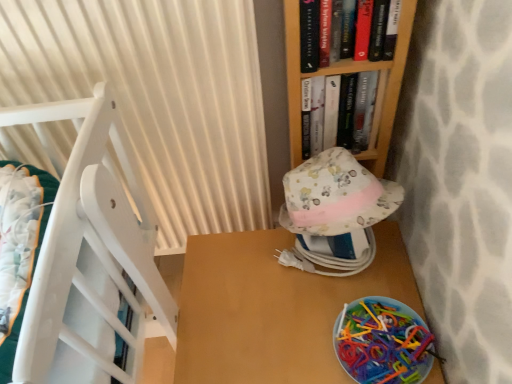
Find the location of `wooden table at lower right`. wooden table at lower right is located at coordinates (273, 308).

Where is `white pleated curtain at left`? The height and width of the screenshot is (384, 512). white pleated curtain at left is located at coordinates [x=158, y=97].

The height and width of the screenshot is (384, 512). Describe the element at coordinates (158, 97) in the screenshot. I see `white pleated curtain at left` at that location.

Describe the element at coordinates (335, 195) in the screenshot. This screenshot has width=512, height=384. I see `floral fabric hat at center` at that location.

What is the approximate width of hardcover book at upper center, the 2th book positioned from the back?

hardcover book at upper center, the 2th book positioned from the back, is 7.91 centimeters wide.

The height and width of the screenshot is (384, 512). Find the location of `translucent plastic toys at lower right`. translucent plastic toys at lower right is located at coordinates (383, 342).

The height and width of the screenshot is (384, 512). In order to click on hardcover book at upper center, arranged as the 1th book when viewed from the back in this screenshot , I will do `click(352, 108)`.

Where is `wooden table at lower right`? wooden table at lower right is located at coordinates (273, 308).

Is hardcover book at upper center, which ranks as the 1th book in front-to-back order, turned away from translucent plastic toys at lower right?

No, hardcover book at upper center, which ranks as the 1th book in front-to-back order, is not facing away from translucent plastic toys at lower right.

Does hardcover book at upper center, the 2th book positioned from the back, have a smaller size compared to translucent plastic toys at lower right?

No, hardcover book at upper center, the 2th book positioned from the back, is not smaller than translucent plastic toys at lower right.

Between hardcover book at upper center, which ranks as the 1th book in front-to-back order, and translucent plastic toys at lower right, which one appears on the right side from the viewer's perspective?

translucent plastic toys at lower right is more to the right.

Is hardcover book at upper center, which ranks as the 1th book in front-to-back order, beside translucent plastic toys at lower right?

They are not placed beside each other.

Relative to white pleated curtain at left, is translucent plastic toys at lower right in front or behind?

Clearly, translucent plastic toys at lower right is behind white pleated curtain at left.

From a real-world perspective, is translucent plastic toys at lower right physically located above or below white pleated curtain at left?

translucent plastic toys at lower right is below white pleated curtain at left.

Are translucent plastic toys at lower right and white pleated curtain at left beside each other?

translucent plastic toys at lower right and white pleated curtain at left are clearly separated.

Does point (407, 376) appear closer or farther from the camera than point (254, 87)?

Point (407, 376) is positioned closer to the camera compared to point (254, 87).

Does point (365, 124) appear closer or farther from the camera than point (302, 335)?

Point (365, 124) is positioned farther from the camera compared to point (302, 335).

Based on the photo, considering the relative positions of hardcover book at upper center, arranged as the 1th book when viewed from the back, and wooden table at lower right in the image provided, is hardcover book at upper center, arranged as the 1th book when viewed from the back, to the left of wooden table at lower right from the viewer's perspective?

No.

From a real-world perspective, does hardcover book at upper center, arranged as the 1th book when viewed from the back, sit lower than wooden table at lower right?

No, from a real-world perspective, hardcover book at upper center, arranged as the 1th book when viewed from the back, is not beneath wooden table at lower right.

Is hardcover book at upper center, arranged as the 1th book when viewed from the back, located outside white pleated curtain at left?

Yes, hardcover book at upper center, arranged as the 1th book when viewed from the back, is located beyond the bounds of white pleated curtain at left.

From a real-world perspective, between hardcover book at upper center, which is the second book from front to back, and white pleated curtain at left, who is vertically lower?

white pleated curtain at left is physically lower.

You are a GUI agent. You are given a task and a screenshot of the screen. Output one action in this format:
    pyautogui.click(x=<x>, y=<y>)
    Task: Click on the 1st book directly above the white pleated curtain at left (from a real-world perspective)
    The image size is (512, 384).
    Given the screenshot: What is the action you would take?
    pyautogui.click(x=352, y=108)

Which point is more forward, [302,138] or [8,75]?

The point [8,75] is closer to the camera.

Between wooden table at lower right and hardcover book at upper center, which ranks as the 1th book in front-to-back order, which one has smaller size?

Smaller between the two is hardcover book at upper center, which ranks as the 1th book in front-to-back order.

Is wooden table at lower right turned away from hardcover book at upper center, the 2th book positioned from the back?

No, wooden table at lower right is not facing the opposite direction of hardcover book at upper center, the 2th book positioned from the back.

Based on the photo, between wooden table at lower right and hardcover book at upper center, the 2th book positioned from the back, which one appears on the right side from the viewer's perspective?

From the viewer's perspective, hardcover book at upper center, the 2th book positioned from the back, appears more on the right side.

Does wooden table at lower right have a greater width compared to hardcover book at upper center, the 2th book positioned from the back?

Yes, wooden table at lower right is wider than hardcover book at upper center, the 2th book positioned from the back.

The image size is (512, 384). Identify the location of hat located below the white pleated curtain at left (from the image's perspective). (335, 195).

Considering the relative sizes of white pleated curtain at left and floral fabric hat at center in the image provided, is white pleated curtain at left taller than floral fabric hat at center?

Correct, white pleated curtain at left is much taller as floral fabric hat at center.

Is white pleated curtain at left oriented towards floral fabric hat at center?

No.

Considering the points (154, 47) and (347, 179), which point is in front, point (154, 47) or point (347, 179)?

Point (347, 179)

Considering the points (386, 189) and (367, 25), which point is behind, point (386, 189) or point (367, 25)?

The point (386, 189) is behind.

Can you confirm if floral fabric hat at center is positioned to the left of hardcover book at upper center, the 2th book positioned from the back?

No.

Is hardcover book at upper center, which ranks as the 1th book in front-to-back order, inside floral fabric hat at center?

No, hardcover book at upper center, which ranks as the 1th book in front-to-back order, is not a part of floral fabric hat at center.

Which of these two, floral fabric hat at center or hardcover book at upper center, the 2th book positioned from the back, stands taller?

Standing taller between the two is hardcover book at upper center, the 2th book positioned from the back.

Where is `stuff that appears on the right of hardcover book at upper center, the 2th book positioned from the back`? The image size is (512, 384). stuff that appears on the right of hardcover book at upper center, the 2th book positioned from the back is located at coordinates (383, 342).

You are a GUI agent. You are given a task and a screenshot of the screen. Output one action in this format:
    pyautogui.click(x=<x>, y=<y>)
    Task: Click on the curtain that is on the left side of translucent plastic toys at lower right
    
    Given the screenshot: What is the action you would take?
    pyautogui.click(x=158, y=97)

Based on their spatial positions, is floral fabric hat at center or hardcover book at upper center, which is the second book from front to back, closer to translucent plastic toys at lower right?

Among the two, floral fabric hat at center is located nearer to translucent plastic toys at lower right.

Estimate the real-world distances between objects in this image. Which object is closer to translucent plastic toys at lower right, hardcover book at upper center, which ranks as the 1th book in front-to-back order, or hardcover book at upper center, arranged as the 1th book when viewed from the back?

Based on the image, hardcover book at upper center, arranged as the 1th book when viewed from the back, appears to be nearer to translucent plastic toys at lower right.

Considering their positions, is wooden table at lower right positioned further to hardcover book at upper center, which is the second book from front to back, than translucent plastic toys at lower right?

translucent plastic toys at lower right is further to hardcover book at upper center, which is the second book from front to back.

Based on their spatial positions, is translucent plastic toys at lower right or hardcover book at upper center, arranged as the 1th book when viewed from the back, closer to floral fabric hat at center?

hardcover book at upper center, arranged as the 1th book when viewed from the back, is closer to floral fabric hat at center.

Looking at the image, which one is located further to hardcover book at upper center, which is the second book from front to back, wooden table at lower right or white pleated curtain at left?

Based on the image, wooden table at lower right appears to be further to hardcover book at upper center, which is the second book from front to back.

When comparing their distances from hardcover book at upper center, arranged as the 1th book when viewed from the back, does wooden table at lower right or floral fabric hat at center seem closer?

floral fabric hat at center is positioned closer to the anchor hardcover book at upper center, arranged as the 1th book when viewed from the back.

Considering their positions, is hardcover book at upper center, which is the second book from front to back, positioned closer to hardcover book at upper center, the 2th book positioned from the back, than white pleated curtain at left?

Among the two, hardcover book at upper center, which is the second book from front to back, is located nearer to hardcover book at upper center, the 2th book positioned from the back.

From the image, which object appears to be farther from floral fabric hat at center, hardcover book at upper center, arranged as the 1th book when viewed from the back, or wooden table at lower right?

The object further to floral fabric hat at center is wooden table at lower right.

This screenshot has height=384, width=512. I want to click on book between hardcover book at upper center, the 2th book positioned from the back, and translucent plastic toys at lower right from top to bottom, so click(x=352, y=108).

The width and height of the screenshot is (512, 384). What are the coordinates of `curtain between hardcover book at upper center, the 2th book positioned from the back, and translucent plastic toys at lower right from top to bottom` in the screenshot? It's located at (158, 97).

This screenshot has height=384, width=512. I want to click on stuff between floral fabric hat at center and wooden table at lower right in the vertical direction, so click(383, 342).

Where is `curtain between hardcover book at upper center, the 2th book positioned from the back, and wooden table at lower right in the up-down direction`? This screenshot has height=384, width=512. curtain between hardcover book at upper center, the 2th book positioned from the back, and wooden table at lower right in the up-down direction is located at coordinates (158, 97).